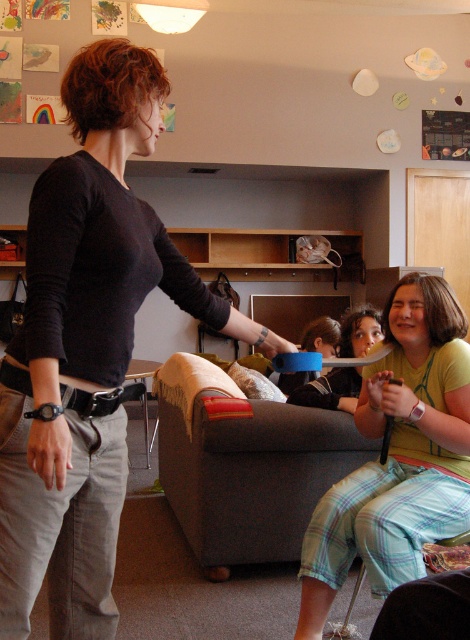
You are a photographer trying to capture a candid shot of the matte black shirt at center and the gray fabric couch at center. Based on their heights, which object should you focus on first to ensure both are in frame?

The matte black shirt at center is taller than the gray fabric couch at center, so you should focus on the matte black shirt at center first to ensure both are in frame.

You are designing a layout for a new living room. You have the matte black shirt at center and the gray fabric couch at center. Considering their sizes, which object should you place closer to the entrance to ensure there is enough space for people to walk comfortably?

The matte black shirt at center is smaller in size compared to the gray fabric couch at center. To ensure enough space for walking, the larger gray fabric couch at center should be placed closer to the entrance, allowing the smaller matte black shirt at center to occupy less space in the pathway.

You are a delivery robot entering the living room. You need to place a small package between the light green cotton shirt at center and the gray fabric couch at center. The package is 30 inches long. Can you fit it there?

The distance between the light green cotton shirt at center and the gray fabric couch at center is 28.82 inches. Since the package is 30 inches long, it cannot fit in the space between them.